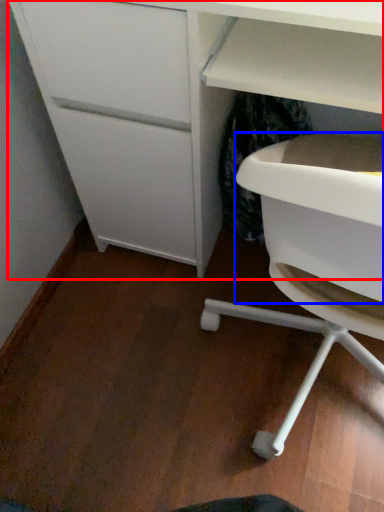
Question: Among these objects, which one is farthest to the camera, desk (highlighted by a red box) or cabinetry (highlighted by a blue box)?

Choices:
 (A) desk
 (B) cabinetry

Answer: (A)